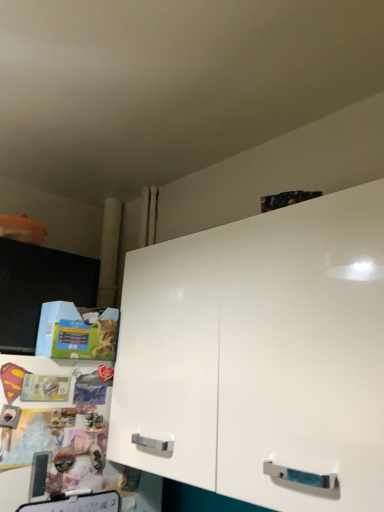
Locate an element on the screen. This screenshot has width=384, height=512. black glossy cabinet at left, which is counted as the first cabinetry, starting from the left is located at coordinates (39, 289).

What do you see at coordinates (39, 289) in the screenshot? I see `black glossy cabinet at left, placed as the 2th cabinetry when sorted from right to left` at bounding box center [39, 289].

In order to face white glossy cabinet at upper right, which ranks as the second cabinetry in left-to-right order, should I rotate leftwards or rightwards?

A 8.470 degree turn to the right will do.

This screenshot has width=384, height=512. Describe the element at coordinates (260, 355) in the screenshot. I see `white glossy cabinet at upper right, positioned as the 1th cabinetry in right-to-left order` at that location.

I want to click on white glossy cabinet at upper right, positioned as the 1th cabinetry in right-to-left order, so click(260, 355).

Where is `black glossy cabinet at left, placed as the 2th cabinetry when sorted from right to left`? black glossy cabinet at left, placed as the 2th cabinetry when sorted from right to left is located at coordinates (39, 289).

Is black glossy cabinet at left, which is counted as the first cabinetry, starting from the left, to the right of white glossy cabinet at upper right, positioned as the 1th cabinetry in right-to-left order, from the viewer's perspective?

In fact, black glossy cabinet at left, which is counted as the first cabinetry, starting from the left, is to the left of white glossy cabinet at upper right, positioned as the 1th cabinetry in right-to-left order.

Is the position of black glossy cabinet at left, which is counted as the first cabinetry, starting from the left, less distant than that of white glossy cabinet at upper right, positioned as the 1th cabinetry in right-to-left order?

No, black glossy cabinet at left, which is counted as the first cabinetry, starting from the left, is further to the viewer.

Is point (36, 266) positioned behind point (286, 259)?

Yes, it is behind point (286, 259).

From the image's perspective, is black glossy cabinet at left, which is counted as the first cabinetry, starting from the left, located above or below white glossy cabinet at upper right, which ranks as the second cabinetry in left-to-right order?

black glossy cabinet at left, which is counted as the first cabinetry, starting from the left, is above white glossy cabinet at upper right, which ranks as the second cabinetry in left-to-right order.

From a real-world perspective, is black glossy cabinet at left, placed as the 2th cabinetry when sorted from right to left, above or below white glossy cabinet at upper right, positioned as the 1th cabinetry in right-to-left order?

black glossy cabinet at left, placed as the 2th cabinetry when sorted from right to left, is situated higher than white glossy cabinet at upper right, positioned as the 1th cabinetry in right-to-left order, in the real world.

Based on the photo, considering the sizes of objects black glossy cabinet at left, which is counted as the first cabinetry, starting from the left, and white glossy cabinet at upper right, which ranks as the second cabinetry in left-to-right order, in the image provided, who is thinner, black glossy cabinet at left, which is counted as the first cabinetry, starting from the left, or white glossy cabinet at upper right, which ranks as the second cabinetry in left-to-right order,?

Thinner between the two is black glossy cabinet at left, which is counted as the first cabinetry, starting from the left.

Is black glossy cabinet at left, placed as the 2th cabinetry when sorted from right to left, shorter than white glossy cabinet at upper right, which ranks as the second cabinetry in left-to-right order?

Yes, black glossy cabinet at left, placed as the 2th cabinetry when sorted from right to left, is shorter than white glossy cabinet at upper right, which ranks as the second cabinetry in left-to-right order.

Can you confirm if black glossy cabinet at left, placed as the 2th cabinetry when sorted from right to left, is bigger than white glossy cabinet at upper right, which ranks as the second cabinetry in left-to-right order?

No, black glossy cabinet at left, placed as the 2th cabinetry when sorted from right to left, is not bigger than white glossy cabinet at upper right, which ranks as the second cabinetry in left-to-right order.

Would you say black glossy cabinet at left, placed as the 2th cabinetry when sorted from right to left, is outside white glossy cabinet at upper right, which ranks as the second cabinetry in left-to-right order?

Yes.

Is black glossy cabinet at left, which is counted as the first cabinetry, starting from the left, placed right next to white glossy cabinet at upper right, which ranks as the second cabinetry in left-to-right order?

There is a gap between black glossy cabinet at left, which is counted as the first cabinetry, starting from the left, and white glossy cabinet at upper right, which ranks as the second cabinetry in left-to-right order.

Is black glossy cabinet at left, which is counted as the first cabinetry, starting from the left, oriented towards white glossy cabinet at upper right, positioned as the 1th cabinetry in right-to-left order?

No, black glossy cabinet at left, which is counted as the first cabinetry, starting from the left, is not turned towards white glossy cabinet at upper right, positioned as the 1th cabinetry in right-to-left order.

How different are the orientations of black glossy cabinet at left, which is counted as the first cabinetry, starting from the left, and white glossy cabinet at upper right, positioned as the 1th cabinetry in right-to-left order, in degrees?

black glossy cabinet at left, which is counted as the first cabinetry, starting from the left, and white glossy cabinet at upper right, positioned as the 1th cabinetry in right-to-left order, are facing 0.823 degrees away from each other.

Image resolution: width=384 pixels, height=512 pixels. In order to click on cabinetry that is behind the white glossy cabinet at upper right, which ranks as the second cabinetry in left-to-right order in this screenshot , I will do click(39, 289).

In the scene shown: Considering the positions of objects white glossy cabinet at upper right, positioned as the 1th cabinetry in right-to-left order, and black glossy cabinet at left, which is counted as the first cabinetry, starting from the left, in the image provided, who is more to the left, white glossy cabinet at upper right, positioned as the 1th cabinetry in right-to-left order, or black glossy cabinet at left, which is counted as the first cabinetry, starting from the left,?

Positioned to the left is black glossy cabinet at left, which is counted as the first cabinetry, starting from the left.

Does white glossy cabinet at upper right, positioned as the 1th cabinetry in right-to-left order, come in front of black glossy cabinet at left, placed as the 2th cabinetry when sorted from right to left?

Yes, the depth of white glossy cabinet at upper right, positioned as the 1th cabinetry in right-to-left order, is less than that of black glossy cabinet at left, placed as the 2th cabinetry when sorted from right to left.

Which is further, (201, 245) or (9, 348)?

The point (9, 348) is more distant.

From the image's perspective, is white glossy cabinet at upper right, positioned as the 1th cabinetry in right-to-left order, on black glossy cabinet at left, which is counted as the first cabinetry, starting from the left?

No, from the image's perspective, white glossy cabinet at upper right, positioned as the 1th cabinetry in right-to-left order, is not on top of black glossy cabinet at left, which is counted as the first cabinetry, starting from the left.

From a real-world perspective, who is located higher, white glossy cabinet at upper right, which ranks as the second cabinetry in left-to-right order, or black glossy cabinet at left, which is counted as the first cabinetry, starting from the left?

In real-world perspective, black glossy cabinet at left, which is counted as the first cabinetry, starting from the left, is above.

Considering the relative sizes of white glossy cabinet at upper right, positioned as the 1th cabinetry in right-to-left order, and black glossy cabinet at left, placed as the 2th cabinetry when sorted from right to left, in the image provided, is white glossy cabinet at upper right, positioned as the 1th cabinetry in right-to-left order, wider than black glossy cabinet at left, placed as the 2th cabinetry when sorted from right to left,?

Yes, white glossy cabinet at upper right, positioned as the 1th cabinetry in right-to-left order, is wider than black glossy cabinet at left, placed as the 2th cabinetry when sorted from right to left.

Between white glossy cabinet at upper right, positioned as the 1th cabinetry in right-to-left order, and black glossy cabinet at left, placed as the 2th cabinetry when sorted from right to left, which one has more height?

With more height is white glossy cabinet at upper right, positioned as the 1th cabinetry in right-to-left order.

Looking at this image, between white glossy cabinet at upper right, which ranks as the second cabinetry in left-to-right order, and black glossy cabinet at left, placed as the 2th cabinetry when sorted from right to left, which one has smaller size?

black glossy cabinet at left, placed as the 2th cabinetry when sorted from right to left.

From the picture: Is black glossy cabinet at left, placed as the 2th cabinetry when sorted from right to left, completely or partially inside white glossy cabinet at upper right, which ranks as the second cabinetry in left-to-right order?

No, black glossy cabinet at left, placed as the 2th cabinetry when sorted from right to left, is located outside of white glossy cabinet at upper right, which ranks as the second cabinetry in left-to-right order.

Is white glossy cabinet at upper right, which ranks as the second cabinetry in left-to-right order, touching black glossy cabinet at left, placed as the 2th cabinetry when sorted from right to left?

white glossy cabinet at upper right, which ranks as the second cabinetry in left-to-right order, and black glossy cabinet at left, placed as the 2th cabinetry when sorted from right to left, are clearly separated.

Could you tell me if white glossy cabinet at upper right, positioned as the 1th cabinetry in right-to-left order, is facing black glossy cabinet at left, which is counted as the first cabinetry, starting from the left?

No, white glossy cabinet at upper right, positioned as the 1th cabinetry in right-to-left order, is not aimed at black glossy cabinet at left, which is counted as the first cabinetry, starting from the left.

How many degrees apart are the facing directions of white glossy cabinet at upper right, positioned as the 1th cabinetry in right-to-left order, and black glossy cabinet at left, placed as the 2th cabinetry when sorted from right to left?

They differ by 0.823 degrees in their facing directions.

Where is `cabinetry on the left of the white glossy cabinet at upper right, which ranks as the second cabinetry in left-to-right order`? cabinetry on the left of the white glossy cabinet at upper right, which ranks as the second cabinetry in left-to-right order is located at coordinates [x=39, y=289].

I want to click on cabinetry behind the white glossy cabinet at upper right, positioned as the 1th cabinetry in right-to-left order, so click(39, 289).

At what (x,y) coordinates should I click in order to perform the action: click on cabinetry that appears below the black glossy cabinet at left, which is counted as the first cabinetry, starting from the left (from a real-world perspective). Please return your answer as a coordinate pair (x, y). The width and height of the screenshot is (384, 512). Looking at the image, I should click on (260, 355).